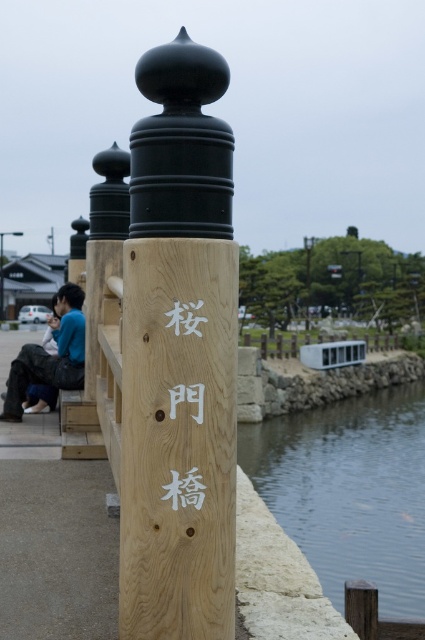
You are standing on the Sakura Gate Bridge and notice the clear water at lower right and the white wood sign at center. Which object appears taller from your perspective?

The clear water at lower right is taller than the white wood sign at center.

You are standing on the Sakura Gate Bridge and want to place a new decorative light at the exact center of the bridge. The natural wood signpost at center is currently located at point 0.558, 0.421. Is the signpost at the correct location for the center of the bridge?

The natural wood signpost at center is located at point (178, 356), which is the exact center of the bridge. Therefore, the signpost is correctly placed at the center of the bridge.

You are standing on the Sakura Gate Bridge and notice the clear water at lower right and the blue cotton shirt at left. Which object is positioned to the right of the other?

The clear water at lower right is to the right of the blue cotton shirt at left.